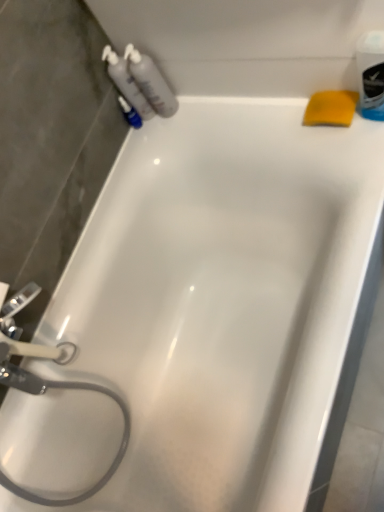
This screenshot has height=512, width=384. What are the coordinates of `free spot to the left of yellow sponge at upper right` in the screenshot? It's located at (300, 139).